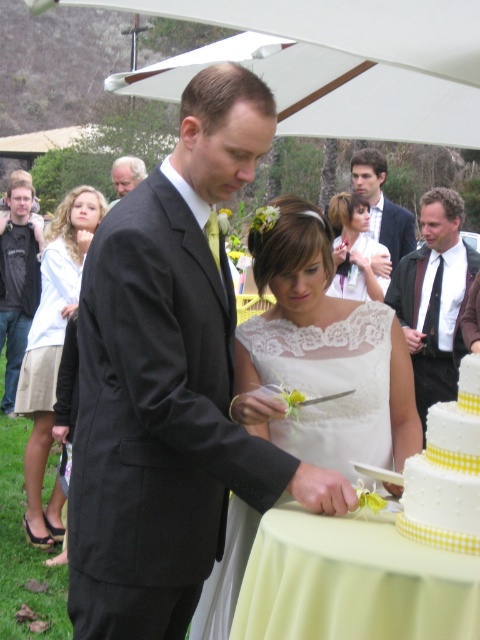
Is brown leather jacket at center closer to the viewer compared to white lace dress at center?

Yes, brown leather jacket at center is closer to the viewer.

Find the location of `brown leather jacket at center`. brown leather jacket at center is located at coordinates (434, 298).

Is point (444, 211) more distant than point (336, 218)?

No, it is in front of (336, 218).

This screenshot has width=480, height=640. I want to click on brown leather jacket at center, so click(x=434, y=298).

Is yellow checkered fabric at lower right taller than gray hair at upper left?

Yes, yellow checkered fabric at lower right is taller than gray hair at upper left.

Between point (430, 419) and point (130, 182), which one is positioned behind?

Positioned behind is point (130, 182).

Between point (432, 536) and point (119, 177), which one is positioned in front?

Point (432, 536) is more forward.

Find the location of a particular element. This screenshot has width=480, height=640. yellow checkered fabric at lower right is located at coordinates (446, 472).

The image size is (480, 640). I want to click on light beige fabric dress at center, so click(x=52, y=349).

Is point (47, 339) positioned after point (7, 269)?

That is False.

Between point (56, 326) and point (27, 198), which one is positioned behind?

Positioned behind is point (27, 198).

Image resolution: width=480 pixels, height=640 pixels. What are the coordinates of `light beige fabric dress at center` in the screenshot? It's located at (52, 349).